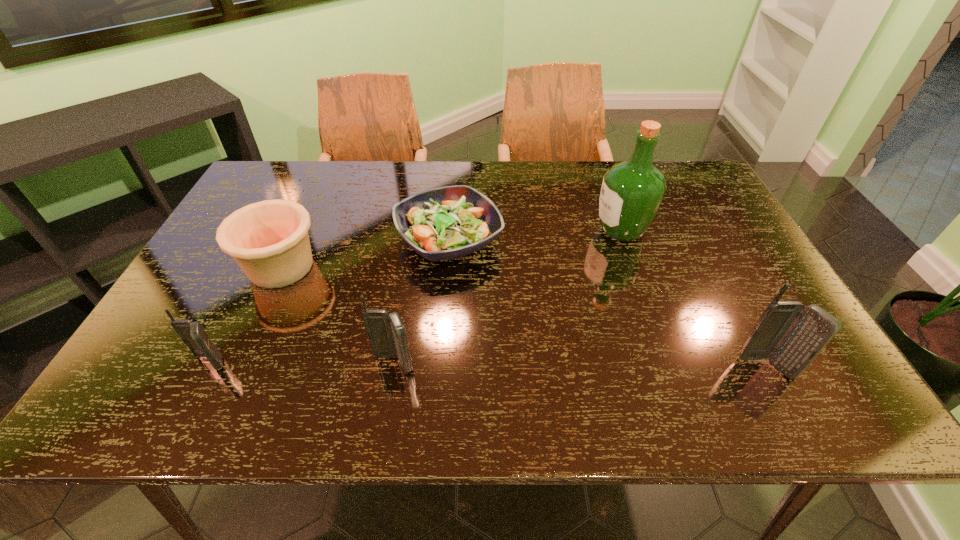
Where is `free space between the shortest object and the tallest object`? This screenshot has width=960, height=540. free space between the shortest object and the tallest object is located at coordinates (535, 235).

Locate an element on the screen. free spot between the salad plate and the pottery is located at coordinates (365, 253).

The width and height of the screenshot is (960, 540). I want to click on free spot between the second cellular telephone from left to right and the pottery, so click(x=338, y=315).

In order to click on vacant point located between the pottery and the salad plate in this screenshot , I will do `click(365, 253)`.

Where is `empty space that is in between the shortest object and the shortest cellular telephone`? empty space that is in between the shortest object and the shortest cellular telephone is located at coordinates (329, 301).

Locate an element on the screen. object that is the fifth closest one to the second tallest cellular telephone is located at coordinates (791, 335).

Locate an element on the screen. The height and width of the screenshot is (540, 960). object that is the fifth closest to the second cellular telephone from right to left is located at coordinates (x=791, y=335).

Select which cellular telephone is the closest to the tallest object. Please provide its 2D coordinates. Your answer should be formatted as a tuple, i.e. [(x, y)], where the tuple contains the x and y coordinates of a point satisfying the conditions above.

[(791, 335)]

At what (x,y) coordinates should I click in order to perform the action: click on the closest cellular telephone relative to the tallest cellular telephone. Please return your answer as a coordinate pair (x, y). The width and height of the screenshot is (960, 540). Looking at the image, I should click on click(386, 331).

The height and width of the screenshot is (540, 960). Find the location of `free space that satisfies the following two spatial constraints: 1. on the front-facing side of the liquor; 2. on the front side of the shortest object`. free space that satisfies the following two spatial constraints: 1. on the front-facing side of the liquor; 2. on the front side of the shortest object is located at coordinates (625, 240).